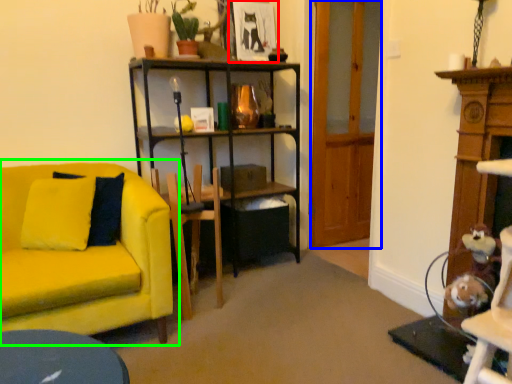
Question: Based on their relative distances, which object is farther from picture frame (highlighted by a red box)? Choose from glass door (highlighted by a blue box) and studio couch (highlighted by a green box).

Choices:
 (A) glass door
 (B) studio couch

Answer: (B)